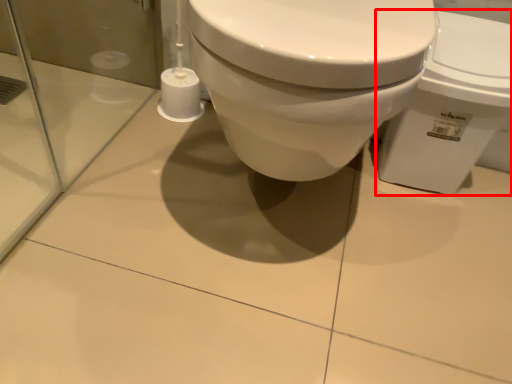
Question: From the image's perspective, what is the correct spatial positioning of toilet (annotated by the red box) in reference to toilet paper?

Choices:
 (A) below
 (B) above

Answer: (A)